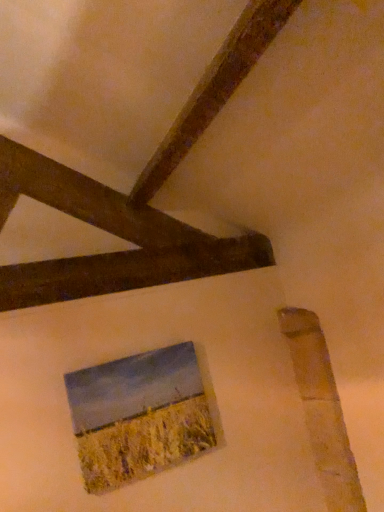
What do you see at coordinates (141, 415) in the screenshot? I see `matte wooden picture frame at lower center` at bounding box center [141, 415].

At what (x,y) coordinates should I click in order to perform the action: click on matte wooden picture frame at lower center. Please return your answer as a coordinate pair (x, y). This screenshot has height=512, width=384. Looking at the image, I should click on 141,415.

Measure the distance between matte wooden picture frame at lower center and camera.

The depth of matte wooden picture frame at lower center is 1.49 meters.

Locate an element on the screen. matte wooden picture frame at lower center is located at coordinates (141, 415).